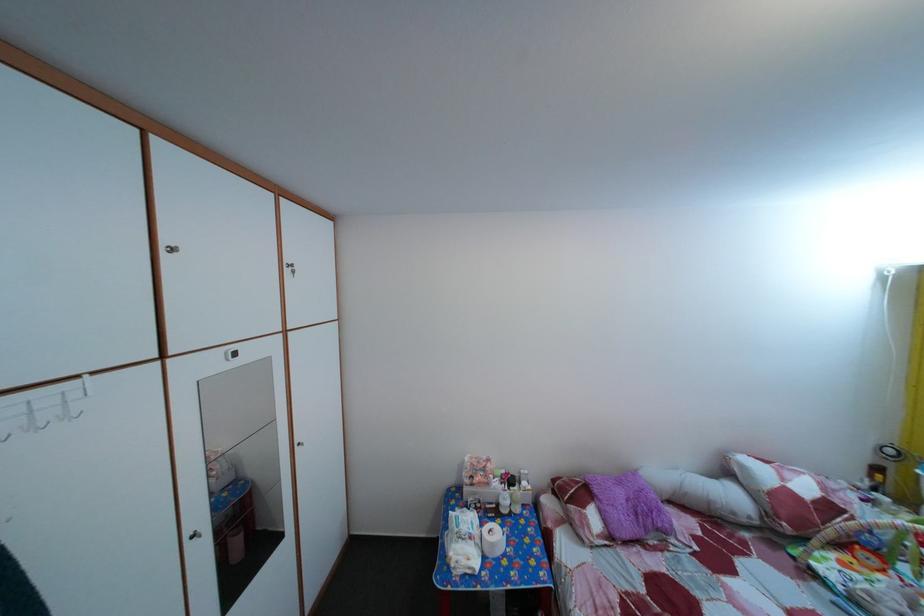
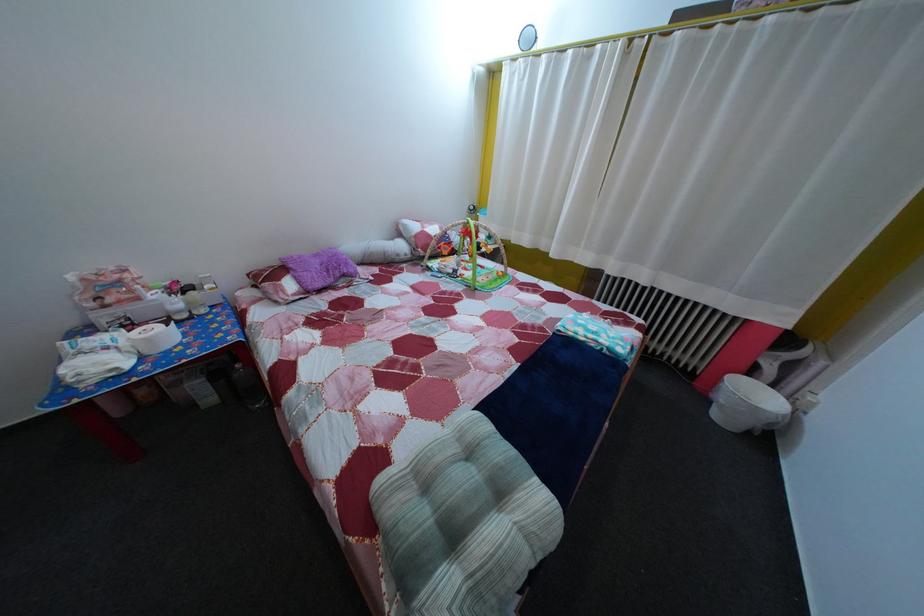
The first image is from the beginning of the video and the second image is from the end. How did the camera likely rotate when shooting the video?

The rotation direction of the camera is right-down.